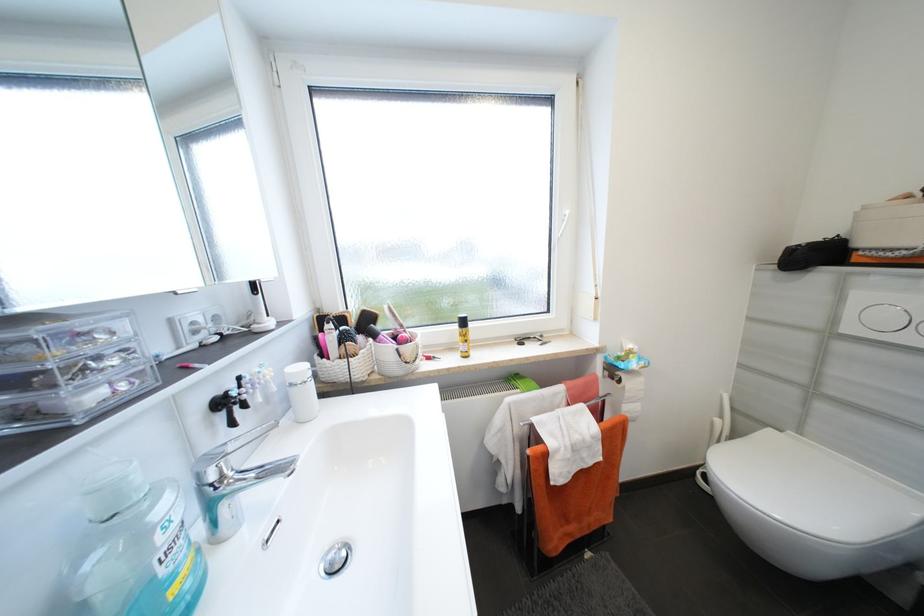
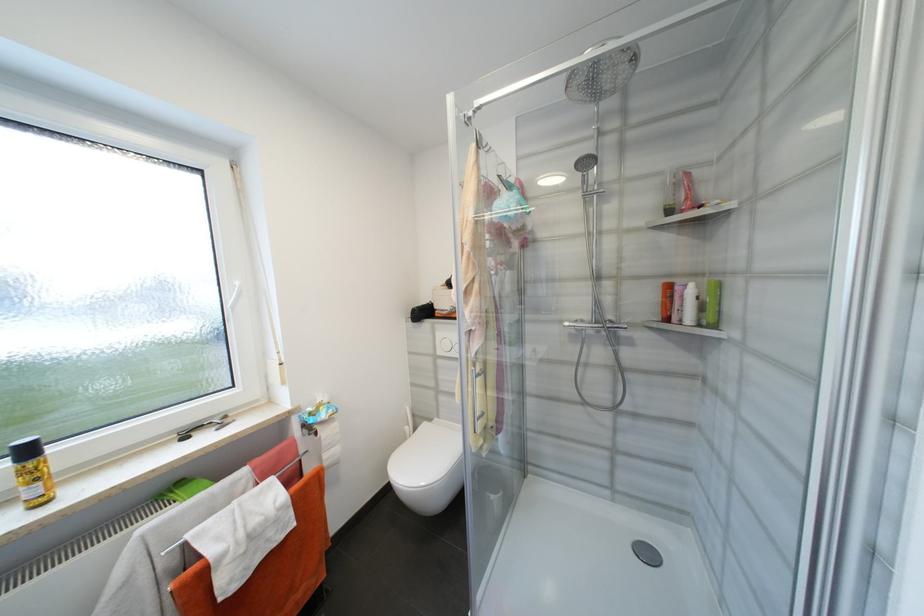
Locate, in the second image, the point that corresponds to (x=469, y=323) in the first image.

(33, 453)